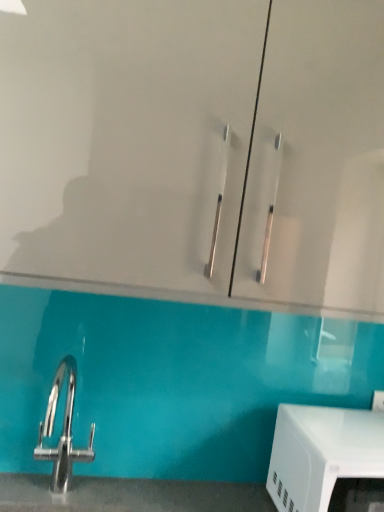
Question: Considering the positions of white glossy microwave at lower right and transparent glass cabinet at upper center in the image, is white glossy microwave at lower right wider or thinner than transparent glass cabinet at upper center?

Choices:
 (A) wide
 (B) thin

Answer: (B)

Question: Is white glossy microwave at lower right inside the boundaries of transparent glass cabinet at upper center, or outside?

Choices:
 (A) inside
 (B) outside

Answer: (B)

Question: Does point (289, 471) appear closer or farther from the camera than point (152, 37)?

Choices:
 (A) closer
 (B) farther

Answer: (B)

Question: Do you think transparent glass cabinet at upper center is within white glossy microwave at lower right, or outside of it?

Choices:
 (A) inside
 (B) outside

Answer: (B)

Question: From a real-world perspective, relative to white glossy microwave at lower right, is transparent glass cabinet at upper center vertically above or below?

Choices:
 (A) below
 (B) above

Answer: (B)

Question: Is transparent glass cabinet at upper center taller or shorter than white glossy microwave at lower right?

Choices:
 (A) short
 (B) tall

Answer: (B)

Question: Is point (193, 215) closer or farther from the camera than point (301, 494)?

Choices:
 (A) closer
 (B) farther

Answer: (A)